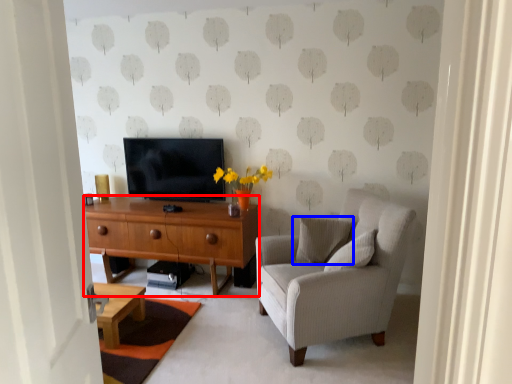
Question: Which of the following is the farthest to the observer, desk (highlighted by a red box) or pillow (highlighted by a blue box)?

Choices:
 (A) desk
 (B) pillow

Answer: (A)